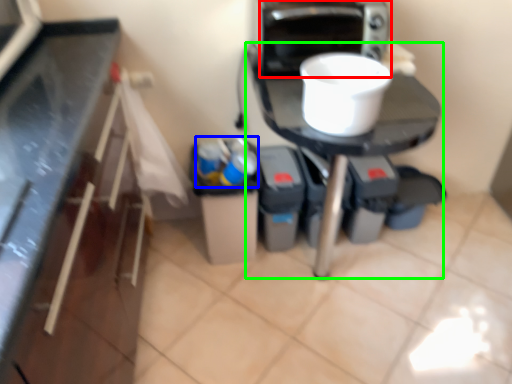
Question: Which is farther away from home appliance (highlighted by a red box)? garbage (highlighted by a blue box) or table (highlighted by a green box)?

Choices:
 (A) garbage
 (B) table

Answer: (A)